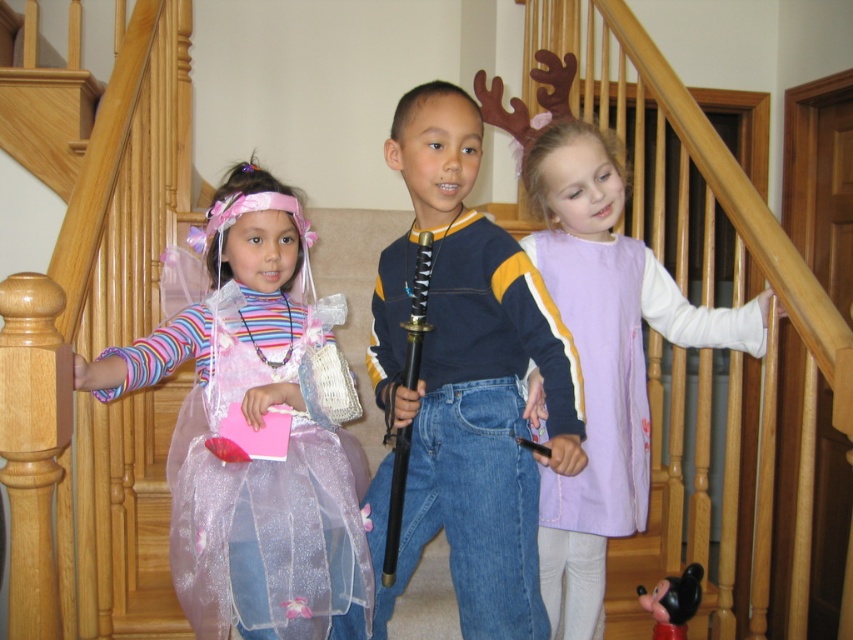
You are a photographer trying to capture a group photo of the blue denim jeans at center and the purple fabric dress at center. To ensure both are visible, you need to adjust your camera angle. Which direction should you move your camera to include both subjects in the frame?

The blue denim jeans at center is positioned on the left side of purple fabric dress at center. To include both in the frame, move the camera slightly to the left to capture the blue denim jeans at center and then pan towards the right to include the purple fabric dress at center.

You are a photographer setting up a tripod to take a group photo of the blue denim jeans at center and the purple fabric dress at center. The tripod has a narrow base. Which of the two should you place closer to the edge to ensure stability?

You should place the blue denim jeans at center closer to the edge because it is thinner than the purple fabric dress at center, making it more stable.

Looking at this image, you are a photographer positioned at the camera. You need to focus on the two points in the image. Which point, point (234, 403) or point (614, 451), is closer to your camera?

Point (234, 403) is closer to the camera than point (614, 451).